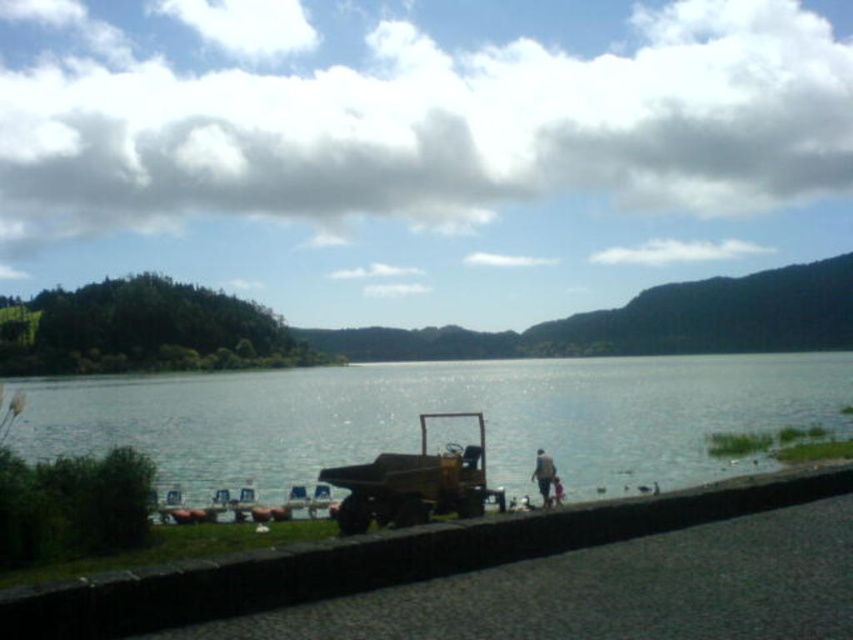
Question: Is clear water at lower center positioned before brown fabric jacket at lower center?

Choices:
 (A) yes
 (B) no

Answer: (A)

Question: Which object appears closest to the camera in this image?

Choices:
 (A) yellow matte truck at center
 (B) clear water at lower center

Answer: (A)

Question: Does clear water at lower center have a lesser width compared to yellow matte truck at center?

Choices:
 (A) no
 (B) yes

Answer: (A)

Question: Which point is closer to the camera?

Choices:
 (A) brown fabric jacket at lower center
 (B) clear water at lower center
 (C) yellow matte truck at center

Answer: (C)

Question: Considering the relative positions of yellow matte truck at center and brown fabric jacket at lower center in the image provided, where is yellow matte truck at center located with respect to brown fabric jacket at lower center?

Choices:
 (A) above
 (B) below

Answer: (A)

Question: Which point is closer to the camera?

Choices:
 (A) (397, 490)
 (B) (314, 449)
 (C) (541, 454)

Answer: (A)